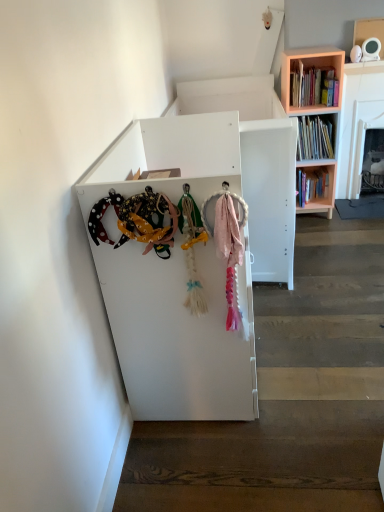
In order to click on pink wooden bookcase at upper right in this screenshot , I will do `click(309, 67)`.

Describe the element at coordinates (309, 67) in the screenshot. The image size is (384, 512). I see `pink wooden bookcase at upper right` at that location.

What is the approximate width of hardcover books at upper right?

The width of hardcover books at upper right is 27.88 centimeters.

I want to click on pink fabric at lower right, so click(x=288, y=397).

Is hardcover books at upper right positioned in front of pink fabric at lower right?

No, it is not.

What's the angular difference between hardcover books at upper right and pink fabric at lower right's facing directions?

→ The facing directions of hardcover books at upper right and pink fabric at lower right are 0.236 degrees apart.

Considering the positions of point (332, 72) and point (337, 388), is point (332, 72) closer or farther from the camera than point (337, 388)?

Point (332, 72).

From the picture: Is hardcover books at upper right thinner than pink fabric at lower right?

Yes, hardcover books at upper right is thinner than pink fabric at lower right.

Is hardcover books at upper right wider than pink wooden bookcase at upper right?

Incorrect, the width of hardcover books at upper right does not surpass that of pink wooden bookcase at upper right.

Is hardcover books at upper right positioned far away from pink wooden bookcase at upper right?

hardcover books at upper right is actually quite close to pink wooden bookcase at upper right.

From the image's perspective, who appears lower, hardcover books at upper right or pink wooden bookcase at upper right?

pink wooden bookcase at upper right.

Does pink fabric at lower right turn towards pink wooden bookcase at upper right?

No, pink fabric at lower right does not turn towards pink wooden bookcase at upper right.

Would you say pink fabric at lower right is outside pink wooden bookcase at upper right?

pink fabric at lower right lies outside pink wooden bookcase at upper right's area.

Consider the image. From a real-world perspective, is pink fabric at lower right located beneath pink wooden bookcase at upper right?

Yes, from a real-world perspective, pink fabric at lower right is under pink wooden bookcase at upper right.

Is pink wooden bookcase at upper right oriented away from pink fabric at lower right?

No, pink fabric at lower right is not at the back of pink wooden bookcase at upper right.

What's the angular difference between pink wooden bookcase at upper right and pink fabric at lower right's facing directions?

pink wooden bookcase at upper right and pink fabric at lower right are facing 0.531 degrees away from each other.

From the picture: From a real-world perspective, between pink wooden bookcase at upper right and pink fabric at lower right, who is vertically higher?

From a 3D spatial view, pink wooden bookcase at upper right is above.

From the image's perspective, would you say pink wooden bookcase at upper right is shown under pink fabric at lower right?

No.

Could hardcover books at upper right be considered to be inside pink wooden bookcase at upper right?

Indeed, hardcover books at upper right is located within pink wooden bookcase at upper right.

Is pink wooden bookcase at upper right touching hardcover books at upper right?

Indeed, pink wooden bookcase at upper right and hardcover books at upper right are beside each other and touching.

Considering the relative sizes of pink wooden bookcase at upper right and hardcover books at upper right in the image provided, is pink wooden bookcase at upper right bigger than hardcover books at upper right?

Yes, pink wooden bookcase at upper right is bigger than hardcover books at upper right.

In the scene shown: Considering the sizes of objects pink fabric at lower right and hardcover books at upper right in the image provided, who is smaller, pink fabric at lower right or hardcover books at upper right?

hardcover books at upper right.

Can you tell me how much pink fabric at lower right and hardcover books at upper right differ in facing direction?

pink fabric at lower right and hardcover books at upper right are facing 0.236 degrees away from each other.

Between pink fabric at lower right and hardcover books at upper right, which one appears on the right side from the viewer's perspective?

pink fabric at lower right.

Is pink fabric at lower right facing away from hardcover books at upper right?

That's not correct — pink fabric at lower right is not looking away from hardcover books at upper right.

Locate an element on the screen. This screenshot has width=384, height=512. stairwell below the hardcover books at upper right (from the image's perspective) is located at coordinates (288, 397).

Locate an element on the screen. This screenshot has width=384, height=512. bookcase that is on the right side of hardcover books at upper right is located at coordinates (309, 67).

Estimate the real-world distances between objects in this image. Which object is closer to pink fabric at lower right, hardcover books at upper right or pink wooden bookcase at upper right?

The object closer to pink fabric at lower right is hardcover books at upper right.

From the image, which object appears to be farther from pink wooden bookcase at upper right, pink fabric at lower right or hardcover books at upper right?

pink fabric at lower right.

Considering their positions, is pink fabric at lower right positioned closer to hardcover books at upper right than pink wooden bookcase at upper right?

pink wooden bookcase at upper right is closer to hardcover books at upper right.

Considering their positions, is pink wooden bookcase at upper right positioned closer to pink fabric at lower right than hardcover books at upper right?

The object closer to pink fabric at lower right is hardcover books at upper right.

Which object lies further to the anchor point pink wooden bookcase at upper right, hardcover books at upper right or pink fabric at lower right?

The object further to pink wooden bookcase at upper right is pink fabric at lower right.

Which object lies further to the anchor point hardcover books at upper right, pink wooden bookcase at upper right or pink fabric at lower right?

pink fabric at lower right is further to hardcover books at upper right.

This screenshot has width=384, height=512. Find the location of `bookcase between pink fabric at lower right and hardcover books at upper right from front to back`. bookcase between pink fabric at lower right and hardcover books at upper right from front to back is located at coordinates (309, 67).